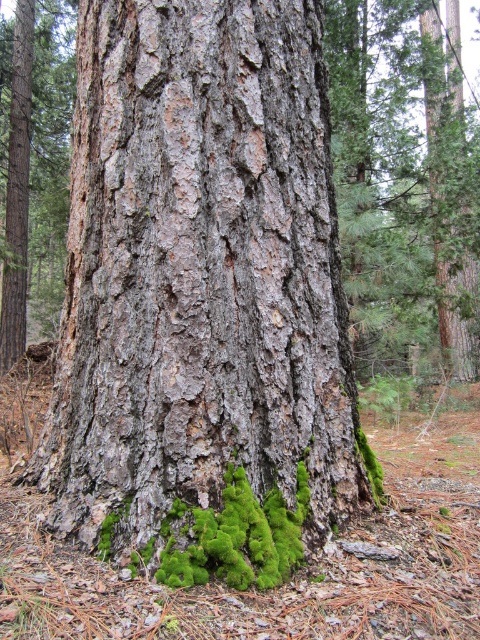
You are standing in a forest and see the smooth bark tree at center. If you walk directly towards the tree, will you first encounter the moss growing at its base before reaching the trunk?

Yes, the smooth bark tree at center has moss growing at its base, so walking directly towards it, you would first encounter the moss before reaching the trunk.

Consider the image. You are a gardener trying to determine if the gray rough bark tree trunk at center and the green fuzzy moss at lower center are close enough to be treated with a single application of fertilizer. The fertilizer can cover an area within 15 inches. Can you apply it to both?

The distance between the gray rough bark tree trunk at center and the green fuzzy moss at lower center is 14.99 inches, which is within the 15 inches coverage of the fertilizer. Therefore, you can apply the fertilizer to both areas.

You are a hiker who just found a hidden treasure map. The map marks a point at coordinates point (x=199, y=269). Based on the scene, where is this point located?

The point (x=199, y=269) is on the gray rough bark tree trunk at center.